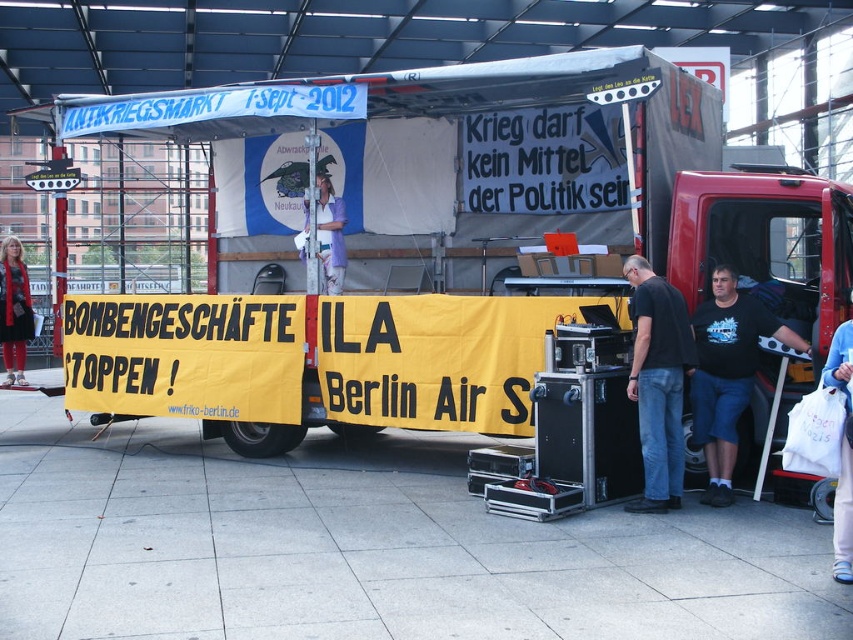
Question: In this image, where is yellow fabric banner at center located relative to black t-shirt at center?

Choices:
 (A) right
 (B) left

Answer: (B)

Question: Does yellow fabric banner at center have a lesser width compared to black t-shirt at center?

Choices:
 (A) yes
 (B) no

Answer: (A)

Question: Among these objects, which one is nearest to the camera?

Choices:
 (A) white plastic bag at lower right
 (B) black t-shirt at center

Answer: (A)

Question: Which of these objects is positioned farthest from the white plastic bag at lower right?

Choices:
 (A) black matte shirt at center
 (B) black t-shirt at center
 (C) white fabric at center
 (D) matte black truck at right

Answer: (C)

Question: Which object is the farthest from the matte black truck at right?

Choices:
 (A) black t-shirt at center
 (B) white fabric at center
 (C) yellow fabric banner at center

Answer: (C)

Question: Observing the image, what is the correct spatial positioning of yellow fabric banner at center in reference to white fabric at center?

Choices:
 (A) right
 (B) left

Answer: (B)